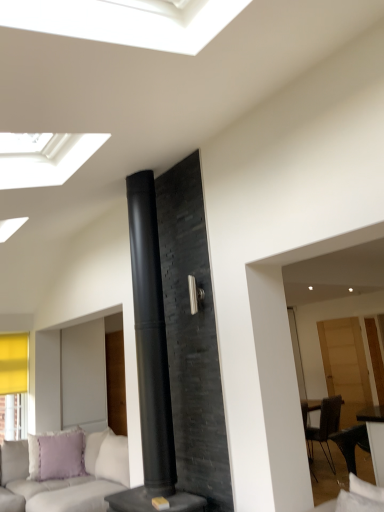
Question: Is light gray fabric couch at lower left taller or shorter than lavender fabric pillow at lower left?

Choices:
 (A) short
 (B) tall

Answer: (B)

Question: Based on their sizes in the image, would you say light gray fabric couch at lower left is bigger or smaller than lavender fabric pillow at lower left?

Choices:
 (A) big
 (B) small

Answer: (A)

Question: Which object is the farthest from the black matte fireplace at center?

Choices:
 (A) lavender fabric pillow at lower left
 (B) light gray fabric couch at lower left
 (C) translucent wood door at right

Answer: (C)

Question: Estimate the real-world distances between objects in this image. Which object is farther from the translucent wood door at right?

Choices:
 (A) lavender fabric pillow at lower left
 (B) black matte fireplace at center
 (C) light gray fabric couch at lower left

Answer: (B)